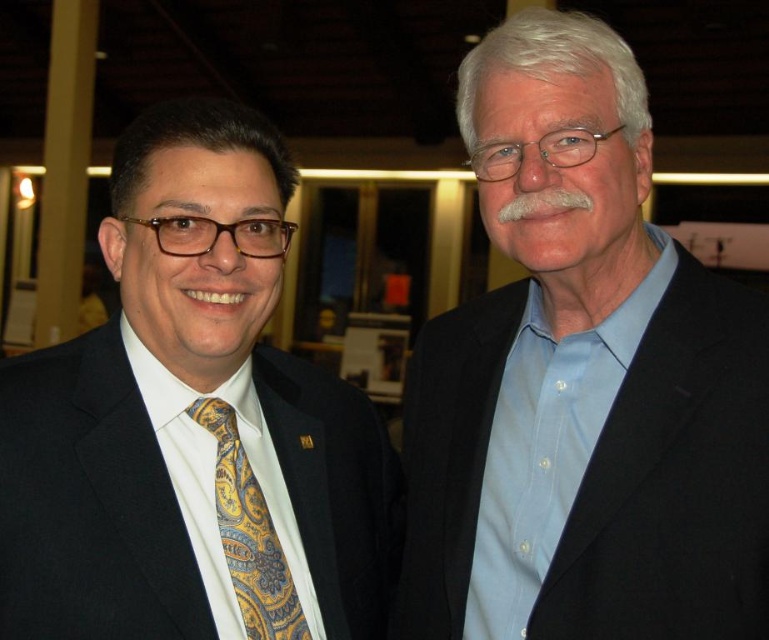
Question: Which of these objects is positioned farthest from the matte black suit at left?

Choices:
 (A) yellow paisley silk tie at left
 (B) blue cotton shirt at right

Answer: (B)

Question: Does matte black suit at left come in front of yellow paisley silk tie at left?

Choices:
 (A) no
 (B) yes

Answer: (B)

Question: Considering the real-world distances, which object is farthest from the yellow paisley silk tie at left?

Choices:
 (A) blue cotton shirt at right
 (B) matte black suit at left

Answer: (A)

Question: Does matte black suit at left have a lesser width compared to yellow paisley silk tie at left?

Choices:
 (A) yes
 (B) no

Answer: (B)

Question: Is blue cotton shirt at right to the left of yellow paisley silk tie at left from the viewer's perspective?

Choices:
 (A) yes
 (B) no

Answer: (B)

Question: Which object is closer to the camera taking this photo?

Choices:
 (A) yellow paisley silk tie at left
 (B) blue cotton shirt at right

Answer: (B)